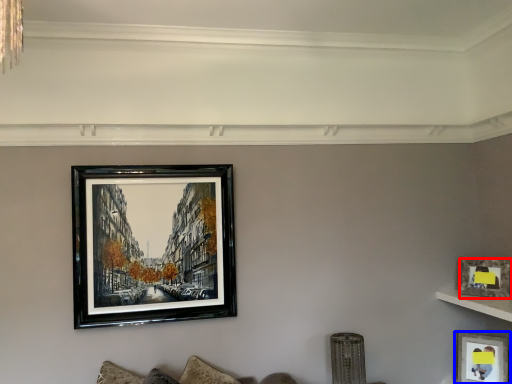
Question: Among these objects, which one is farthest to the camera, picture frame (highlighted by a red box) or picture frame (highlighted by a blue box)?

Choices:
 (A) picture frame
 (B) picture frame

Answer: (B)